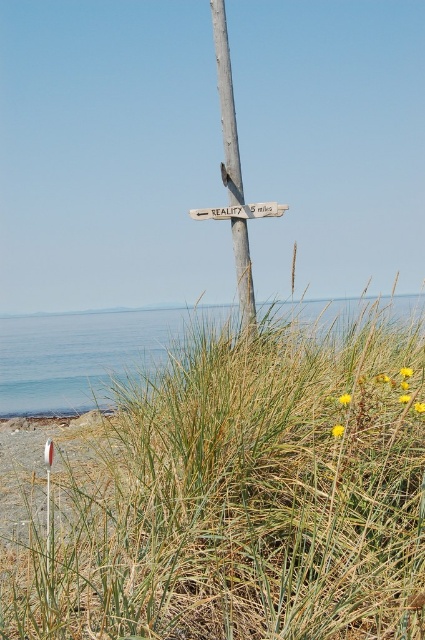
Question: Estimate the real-world distances between objects in this image. Which object is farther from the white plastic sign at center?

Choices:
 (A) wooden signpost at center
 (B) green grassy at center

Answer: (B)

Question: Is wooden signpost at center smaller than white plastic sign at center?

Choices:
 (A) yes
 (B) no

Answer: (B)

Question: Among these objects, which one is nearest to the camera?

Choices:
 (A) wooden signpost at center
 (B) green grassy at center

Answer: (B)

Question: Which of the following is the closest to the observer?

Choices:
 (A) (201, 627)
 (B) (210, 218)
 (C) (249, 288)

Answer: (A)

Question: Does green grassy at center come behind wooden signpost at center?

Choices:
 (A) no
 (B) yes

Answer: (A)

Question: Can you confirm if green grassy at center is wider than white plastic sign at center?

Choices:
 (A) yes
 (B) no

Answer: (A)